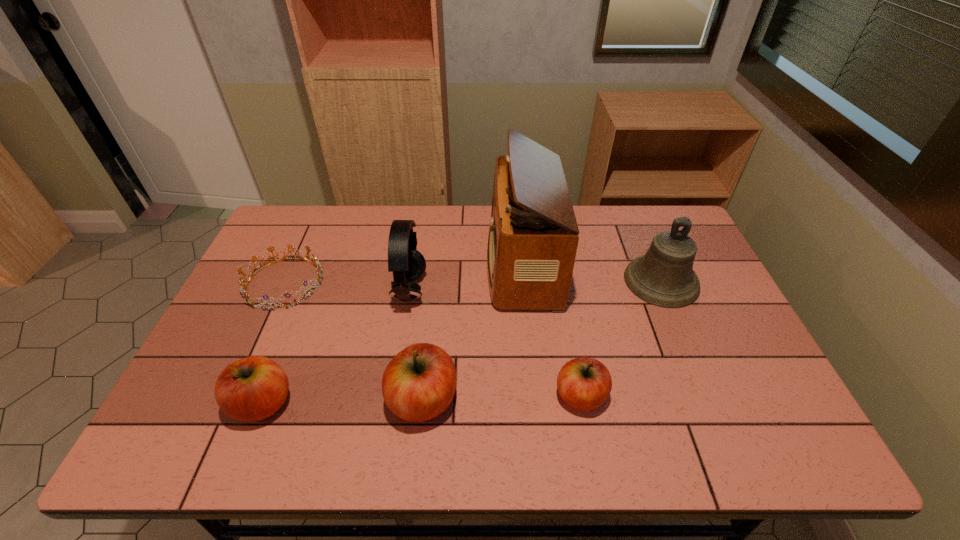
I want to click on free point that keeps the apples evenly spaced on the right, so click(736, 393).